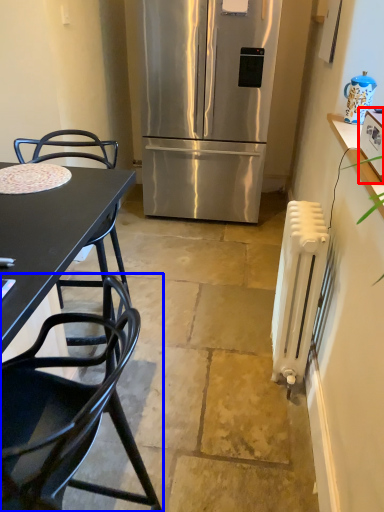
Question: Which of the following is the farthest to the observer, kitchen appliance (highlighted by a red box) or chair (highlighted by a blue box)?

Choices:
 (A) kitchen appliance
 (B) chair

Answer: (A)